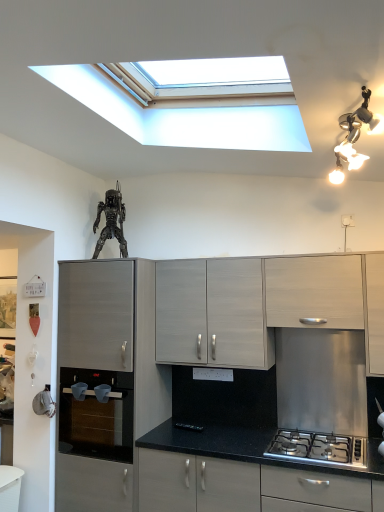
The width and height of the screenshot is (384, 512). Identify the location of black glass oven at lower left. (97, 416).

Identify the location of matte gray cabinet at left, positioned as the 1th cabinetry in left-to-right order. The height and width of the screenshot is (512, 384). (106, 380).

Find the location of a particular element. matte gray cabinet at center, the 2th cabinetry viewed from the left is located at coordinates (213, 313).

Does point (354, 152) lie behind point (240, 474)?

That is False.

You are a GUI agent. You are given a task and a screenshot of the screen. Output one action in this format:
    pyautogui.click(x=<x>, y=<y>)
    Task: Click on the cabinetry that is the 1st one when counting leftward from the silver metallic light fixture at upper right
    The width and height of the screenshot is (384, 512).
    Given the screenshot: What is the action you would take?
    pyautogui.click(x=242, y=464)

From a real-world perspective, who is located higher, silver metallic light fixture at upper right or matte black countertop at lower center, placed as the second cabinetry when sorted from right to left?

Result: silver metallic light fixture at upper right.

Considering the sizes of objects silver metallic light fixture at upper right and matte black countertop at lower center, placed as the second cabinetry when sorted from right to left, in the image provided, who is taller, silver metallic light fixture at upper right or matte black countertop at lower center, placed as the second cabinetry when sorted from right to left,?

With more height is matte black countertop at lower center, placed as the second cabinetry when sorted from right to left.

Is metallic silver figure at upper center placed right next to white wood cabinet at upper right, arranged as the 1th cabinetry when viewed from the right?

metallic silver figure at upper center and white wood cabinet at upper right, arranged as the 1th cabinetry when viewed from the right, are clearly separated.

Is metallic silver figure at upper center facing towards white wood cabinet at upper right, which appears as the fourth cabinetry when viewed from the left?

No, metallic silver figure at upper center is not oriented towards white wood cabinet at upper right, which appears as the fourth cabinetry when viewed from the left.

From the image's perspective, is metallic silver figure at upper center below white wood cabinet at upper right, arranged as the 1th cabinetry when viewed from the right?

Actually, metallic silver figure at upper center appears above white wood cabinet at upper right, arranged as the 1th cabinetry when viewed from the right, in the image.

Does metallic silver figure at upper center have a smaller size compared to white wood cabinet at upper right, which appears as the fourth cabinetry when viewed from the left?

Yes, metallic silver figure at upper center is smaller than white wood cabinet at upper right, which appears as the fourth cabinetry when viewed from the left.

Looking at this image, can you tell me how much matte gray cabinet at left, positioned as the 1th cabinetry in left-to-right order, and matte gray cabinet at center, the 2th cabinetry viewed from the left, differ in facing direction?

The angle between the facing direction of matte gray cabinet at left, positioned as the 1th cabinetry in left-to-right order, and the facing direction of matte gray cabinet at center, the 2th cabinetry viewed from the left, is 0.294 degrees.

Does matte gray cabinet at left, arranged as the 4th cabinetry when viewed from the right, turn towards matte gray cabinet at center, the 2th cabinetry viewed from the left?

No.

Is matte gray cabinet at left, positioned as the 1th cabinetry in left-to-right order, thinner than matte gray cabinet at center, the 2th cabinetry viewed from the left?

Incorrect, the width of matte gray cabinet at left, positioned as the 1th cabinetry in left-to-right order, is not less than that of matte gray cabinet at center, the 2th cabinetry viewed from the left.

Which is further, [81,367] or [243,310]?

The point [81,367] is farther from the camera.

Which of these two, matte gray cabinet at center, which appears as the third cabinetry when viewed from the right, or black glass oven at lower left, is wider?

black glass oven at lower left.

Considering the relative sizes of matte gray cabinet at center, the 2th cabinetry viewed from the left, and black glass oven at lower left in the image provided, is matte gray cabinet at center, the 2th cabinetry viewed from the left, shorter than black glass oven at lower left?

Incorrect, the height of matte gray cabinet at center, the 2th cabinetry viewed from the left, does not fall short of that of black glass oven at lower left.

Is matte gray cabinet at center, the 2th cabinetry viewed from the left, surrounding black glass oven at lower left?

No, black glass oven at lower left is not a part of matte gray cabinet at center, the 2th cabinetry viewed from the left.

Is matte gray cabinet at center, which appears as the third cabinetry when viewed from the right, in front of black glass oven at lower left?

Yes, it is in front of black glass oven at lower left.

Can you confirm if white wood cabinet at upper right, which appears as the fourth cabinetry when viewed from the left, is bigger than matte gray cabinet at center, the 2th cabinetry viewed from the left?

Actually, white wood cabinet at upper right, which appears as the fourth cabinetry when viewed from the left, might be smaller than matte gray cabinet at center, the 2th cabinetry viewed from the left.

From the image's perspective, would you say white wood cabinet at upper right, arranged as the 1th cabinetry when viewed from the right, is positioned over matte gray cabinet at center, which appears as the third cabinetry when viewed from the right?

Yes, from the image's perspective, white wood cabinet at upper right, arranged as the 1th cabinetry when viewed from the right, is above matte gray cabinet at center, which appears as the third cabinetry when viewed from the right.

Which is closer, (x=272, y=293) or (x=215, y=360)?

Point (x=272, y=293) is closer to the camera than point (x=215, y=360).

What's the angular difference between white wood cabinet at upper right, arranged as the 1th cabinetry when viewed from the right, and matte gray cabinet at center, which appears as the third cabinetry when viewed from the right,'s facing directions?

The angular difference between white wood cabinet at upper right, arranged as the 1th cabinetry when viewed from the right, and matte gray cabinet at center, which appears as the third cabinetry when viewed from the right, is 4.57e-05 degrees.

Consider the image. Does white wood cabinet at upper right, arranged as the 1th cabinetry when viewed from the right, have a greater height compared to silver metallic light fixture at upper right?

Correct, white wood cabinet at upper right, arranged as the 1th cabinetry when viewed from the right, is much taller as silver metallic light fixture at upper right.

Are white wood cabinet at upper right, arranged as the 1th cabinetry when viewed from the right, and silver metallic light fixture at upper right making contact?

There is a gap between white wood cabinet at upper right, arranged as the 1th cabinetry when viewed from the right, and silver metallic light fixture at upper right.

In the image, is white wood cabinet at upper right, which appears as the fourth cabinetry when viewed from the left, positioned in front of or behind silver metallic light fixture at upper right?

In the image, white wood cabinet at upper right, which appears as the fourth cabinetry when viewed from the left, appears behind silver metallic light fixture at upper right.

Considering the relative sizes of white wood cabinet at upper right, arranged as the 1th cabinetry when viewed from the right, and silver metallic light fixture at upper right in the image provided, is white wood cabinet at upper right, arranged as the 1th cabinetry when viewed from the right, wider than silver metallic light fixture at upper right?

Correct, the width of white wood cabinet at upper right, arranged as the 1th cabinetry when viewed from the right, exceeds that of silver metallic light fixture at upper right.

Is satin silver gas stove at lower right in contact with matte black countertop at lower center, placed as the second cabinetry when sorted from right to left?

No, satin silver gas stove at lower right is not with matte black countertop at lower center, placed as the second cabinetry when sorted from right to left.

Is satin silver gas stove at lower right in front of or behind matte black countertop at lower center, placed as the second cabinetry when sorted from right to left, in the image?

Visually, satin silver gas stove at lower right is located behind matte black countertop at lower center, placed as the second cabinetry when sorted from right to left.

Considering the sizes of objects satin silver gas stove at lower right and matte black countertop at lower center, the 3th cabinetry from the left, in the image provided, who is bigger, satin silver gas stove at lower right or matte black countertop at lower center, the 3th cabinetry from the left,?

matte black countertop at lower center, the 3th cabinetry from the left.

Where is `light fixture above the matte black countertop at lower center, the 3th cabinetry from the left (from the image's perspective)`? light fixture above the matte black countertop at lower center, the 3th cabinetry from the left (from the image's perspective) is located at coordinates (354, 137).

From a real-world perspective, count 1st cabinetrys downward from the metallic silver figure at upper center and point to it. Please provide its 2D coordinates.

[(314, 292)]

When comparing their distances from matte gray cabinet at left, arranged as the 4th cabinetry when viewed from the right, does satin silver gas stove at lower right or matte black countertop at lower center, placed as the second cabinetry when sorted from right to left, seem closer?

matte black countertop at lower center, placed as the second cabinetry when sorted from right to left.

Based on their spatial positions, is satin silver gas stove at lower right or white wood cabinet at upper right, which appears as the fourth cabinetry when viewed from the left, closer to silver metallic light fixture at upper right?

white wood cabinet at upper right, which appears as the fourth cabinetry when viewed from the left.

Based on their spatial positions, is matte black countertop at lower center, the 3th cabinetry from the left, or white wood cabinet at upper right, arranged as the 1th cabinetry when viewed from the right, further from metallic silver figure at upper center?

The object further to metallic silver figure at upper center is matte black countertop at lower center, the 3th cabinetry from the left.

Estimate the real-world distances between objects in this image. Which object is closer to matte gray cabinet at center, which appears as the third cabinetry when viewed from the right, satin silver gas stove at lower right or silver metallic light fixture at upper right?

Among the two, satin silver gas stove at lower right is located nearer to matte gray cabinet at center, which appears as the third cabinetry when viewed from the right.

Considering their positions, is metallic silver figure at upper center positioned further to satin silver gas stove at lower right than silver metallic light fixture at upper right?

metallic silver figure at upper center.

From the image, which object appears to be nearer to matte gray cabinet at left, arranged as the 4th cabinetry when viewed from the right, matte black countertop at lower center, the 3th cabinetry from the left, or matte gray cabinet at center, which appears as the third cabinetry when viewed from the right?

matte gray cabinet at center, which appears as the third cabinetry when viewed from the right, is positioned closer to the anchor matte gray cabinet at left, arranged as the 4th cabinetry when viewed from the right.

When comparing their distances from metallic silver figure at upper center, does black glass oven at lower left or satin silver gas stove at lower right seem closer?

Based on the image, black glass oven at lower left appears to be nearer to metallic silver figure at upper center.

Looking at the image, which one is located closer to silver metallic light fixture at upper right, matte black countertop at lower center, the 3th cabinetry from the left, or white wood cabinet at upper right, arranged as the 1th cabinetry when viewed from the right?

The object closer to silver metallic light fixture at upper right is white wood cabinet at upper right, arranged as the 1th cabinetry when viewed from the right.

In order to click on oven between silver metallic light fixture at upper right and matte black countertop at lower center, placed as the second cabinetry when sorted from right to left, vertically in this screenshot , I will do `click(97, 416)`.

The height and width of the screenshot is (512, 384). I want to click on gas stove between white wood cabinet at upper right, arranged as the 1th cabinetry when viewed from the right, and matte black countertop at lower center, the 3th cabinetry from the left, in the vertical direction, so click(x=319, y=448).

Locate an element on the screen. This screenshot has width=384, height=512. oven located between matte gray cabinet at left, positioned as the 1th cabinetry in left-to-right order, and satin silver gas stove at lower right in the left-right direction is located at coordinates (97, 416).

Locate an element on the screen. oven that lies between silver metallic light fixture at upper right and satin silver gas stove at lower right from top to bottom is located at coordinates [x=97, y=416].